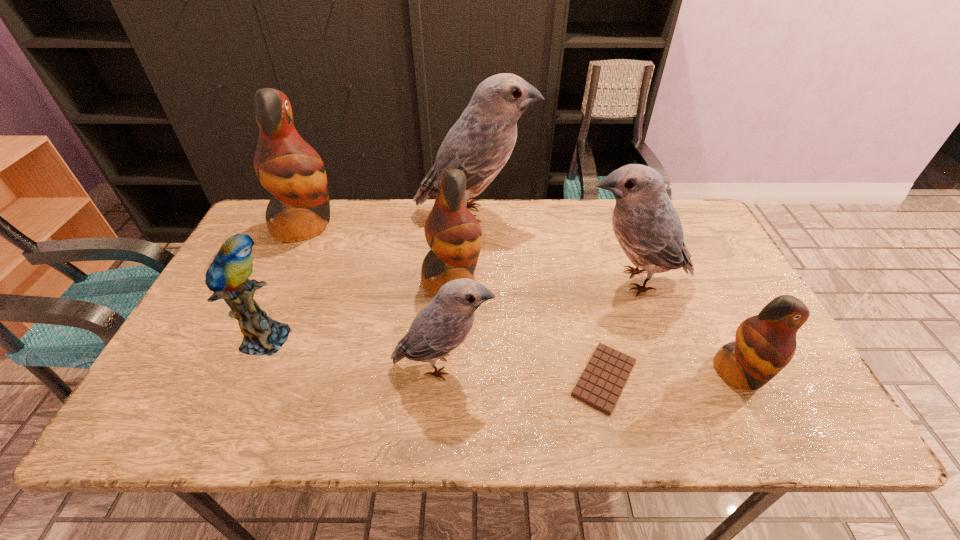
Locate an element on the screen. free space between the smallest gray parrot and the brown chocolate bar is located at coordinates (523, 371).

Where is `empty location between the rightmost gray parrot and the nearest red parrot`? The height and width of the screenshot is (540, 960). empty location between the rightmost gray parrot and the nearest red parrot is located at coordinates (685, 327).

Image resolution: width=960 pixels, height=540 pixels. I want to click on empty space between the farthest red parrot and the smallest gray parrot, so click(x=373, y=295).

Where is `vacant space that's between the biggest gray parrot and the farthest red parrot`? vacant space that's between the biggest gray parrot and the farthest red parrot is located at coordinates (390, 220).

Locate an element on the screen. empty space between the brown chocolate bar and the smallest red parrot is located at coordinates (671, 376).

Locate an element on the screen. The width and height of the screenshot is (960, 540). vacant point located between the leftmost red parrot and the nearest gray parrot is located at coordinates (373, 295).

Find the location of `object identified as the fourth closest to the shortest object`. object identified as the fourth closest to the shortest object is located at coordinates (454, 235).

Point out which object is positioned as the sixth nearest to the brown chocolate bar. Please provide its 2D coordinates. Your answer should be formatted as a tuple, i.e. [(x, y)], where the tuple contains the x and y coordinates of a point satisfying the conditions above.

[(227, 276)]

Point out which parrot is positioned as the third nearest to the rightmost gray parrot. Please provide its 2D coordinates. Your answer should be formatted as a tuple, i.e. [(x, y)], where the tuple contains the x and y coordinates of a point satisfying the conditions above.

[(454, 235)]

Image resolution: width=960 pixels, height=540 pixels. In order to click on parrot object that ranks as the sixth closest to the nearest gray parrot in this screenshot , I will do `click(764, 344)`.